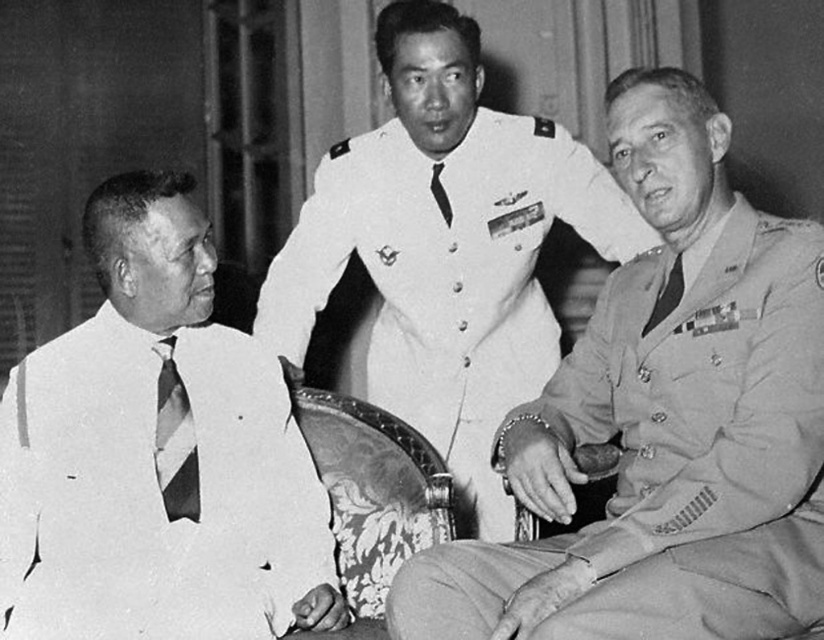
Is satin military uniform at right wider than white cloth uniform at center?

No.

Does point (626, 628) come in front of point (338, 172)?

Yes.

This screenshot has height=640, width=824. I want to click on satin military uniform at right, so click(x=672, y=460).

What do you see at coordinates (448, 276) in the screenshot? This screenshot has height=640, width=824. I see `white cloth uniform at center` at bounding box center [448, 276].

Find the location of a particular element. white cloth uniform at center is located at coordinates (448, 276).

Find the location of a particular element. This screenshot has width=824, height=640. white cloth uniform at center is located at coordinates (448, 276).

Can you confirm if white striped tie at left is smaller than matte striped tie at right?

Incorrect, white striped tie at left is not smaller in size than matte striped tie at right.

Who is more distant from viewer, [279,472] or [681,260]?

Positioned behind is point [279,472].

Which is in front, point (214, 346) or point (668, 289)?

Positioned in front is point (668, 289).

Image resolution: width=824 pixels, height=640 pixels. What are the coordinates of `white striped tie at left` in the screenshot? It's located at (157, 454).